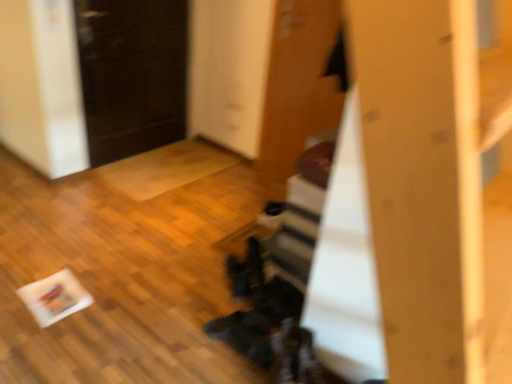
Question: From a real-world perspective, is black glossy door at upper left, the 2th door in the right-to-left sequence, positioned above or below wooden door at upper center, which is the 1th door in right-to-left order?

Choices:
 (A) above
 (B) below

Answer: (B)

Question: Does point (93, 145) appear closer or farther from the camera than point (267, 87)?

Choices:
 (A) closer
 (B) farther

Answer: (B)

Question: Is black glossy door at upper left, the 2th door in the right-to-left sequence, inside or outside of wooden door at upper center, which is the 2th door from left to right?

Choices:
 (A) inside
 (B) outside

Answer: (B)

Question: In terms of width, does wooden door at upper center, which is the 1th door in right-to-left order, look wider or thinner when compared to black glossy door at upper left, the first door in the left-to-right sequence?

Choices:
 (A) wide
 (B) thin

Answer: (B)

Question: Considering the positions of wooden door at upper center, which is the 1th door in right-to-left order, and black glossy door at upper left, the first door in the left-to-right sequence, in the image, is wooden door at upper center, which is the 1th door in right-to-left order, bigger or smaller than black glossy door at upper left, the first door in the left-to-right sequence,?

Choices:
 (A) big
 (B) small

Answer: (B)

Question: Is point (308, 120) closer or farther from the camera than point (131, 127)?

Choices:
 (A) farther
 (B) closer

Answer: (B)

Question: From the image's perspective, is wooden door at upper center, which is the 2th door from left to right, positioned above or below black glossy door at upper left, the first door in the left-to-right sequence?

Choices:
 (A) below
 (B) above

Answer: (A)